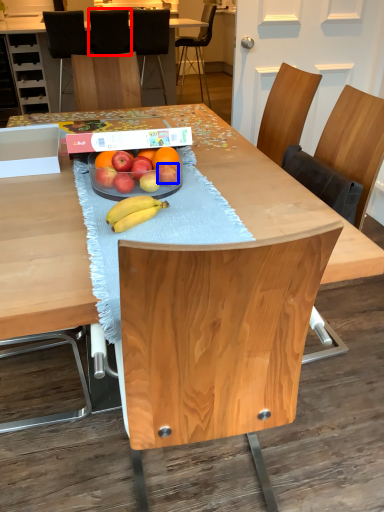
Question: Which of the following is the closest to the observer, chair (highlighted by a red box) or apple (highlighted by a blue box)?

Choices:
 (A) chair
 (B) apple

Answer: (B)